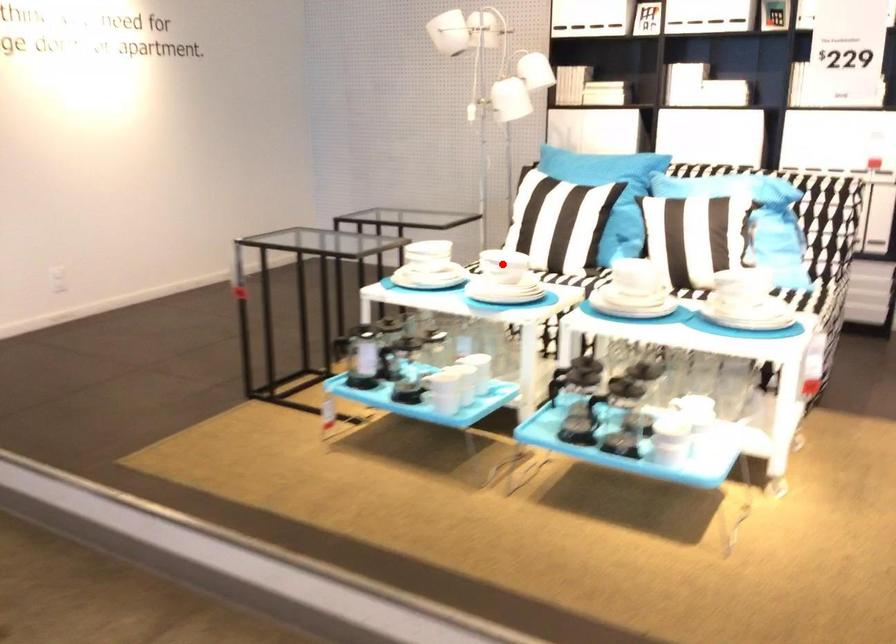
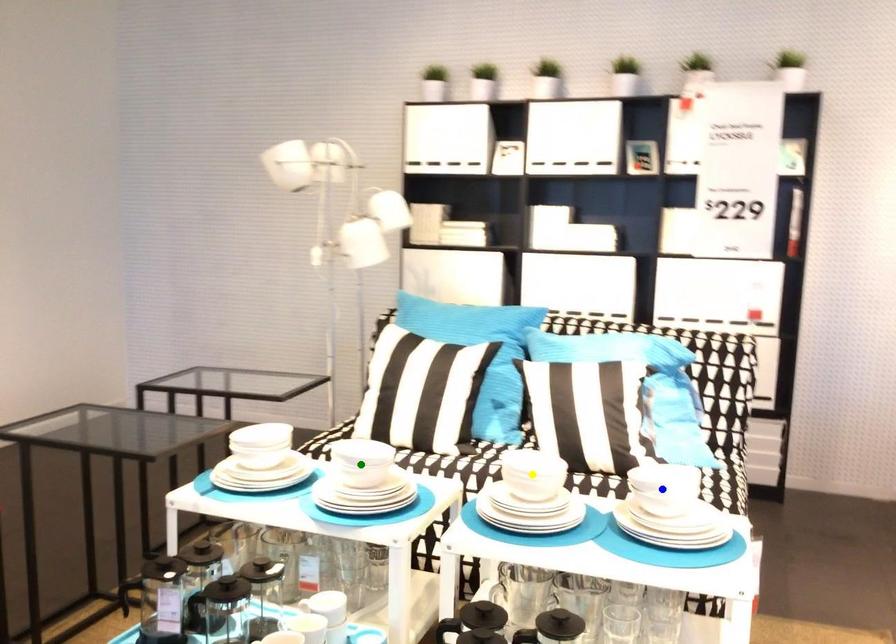
Question: I am providing you with two images of the same scene from different viewpoints. A red point is marked on the first image. You are given multiple points on the second image. In image 2, which mark is for the same physical point as the one in image 1?

Choices:
 (A) green point
 (B) blue point
 (C) yellow point

Answer: (A)